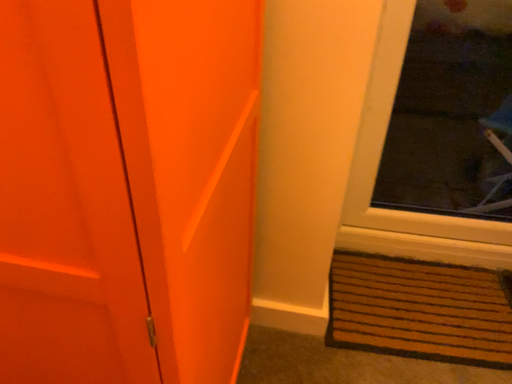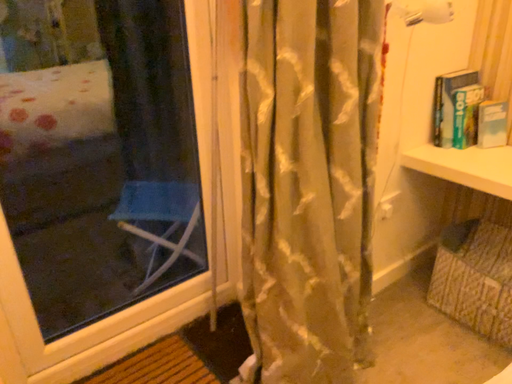
Question: Which way did the camera rotate in the video?

Choices:
 (A) rotated upward
 (B) rotated downward

Answer: (A)